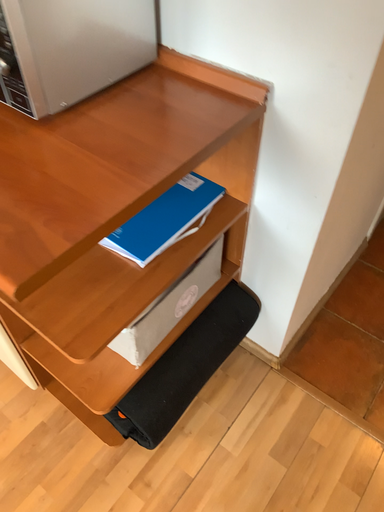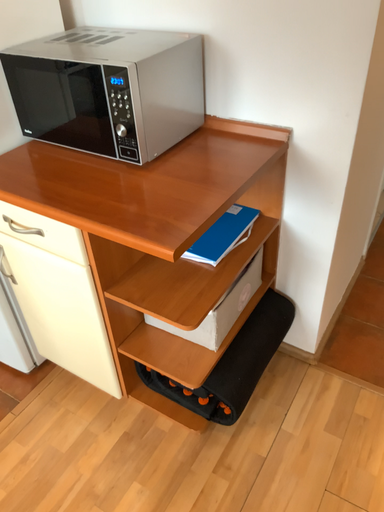
Question: How did the camera likely rotate when shooting the video?

Choices:
 (A) rotated upward
 (B) rotated downward

Answer: (A)